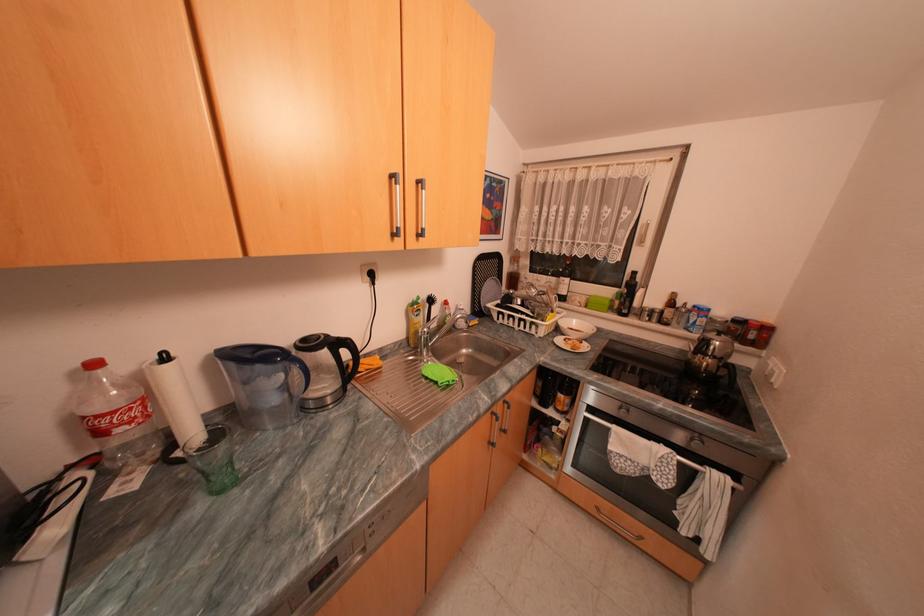
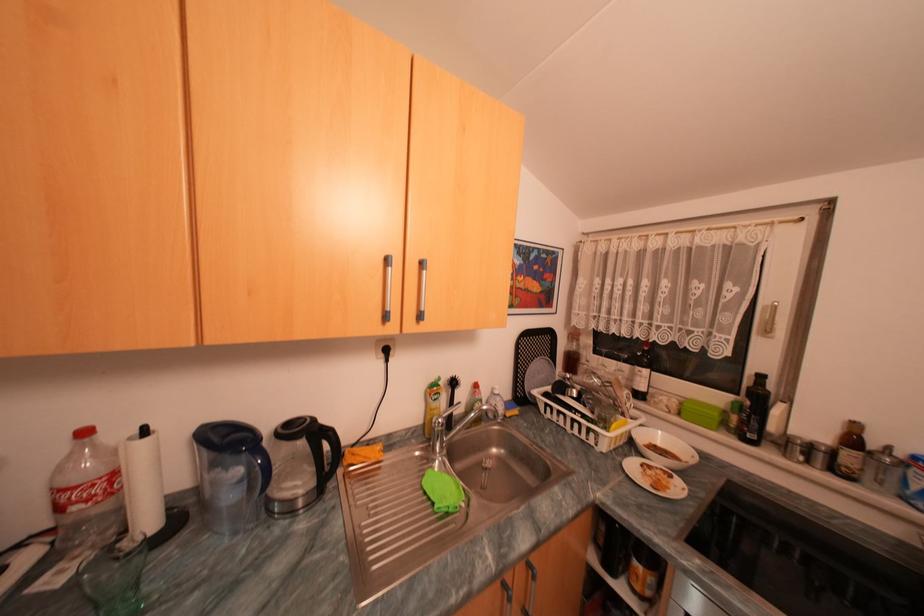
Locate, in the second image, the point that corresponds to pixel 421 330 in the first image.

(438, 416)